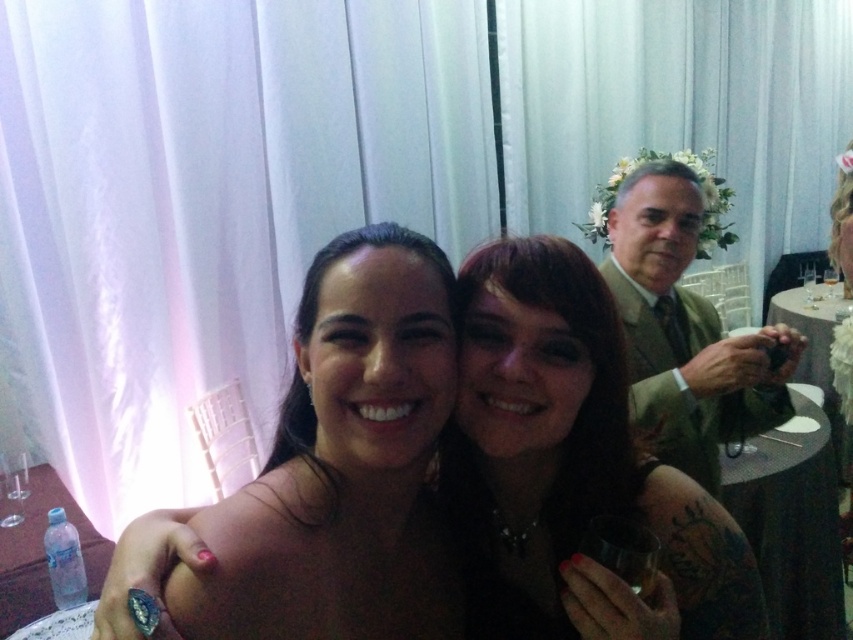
Does wooden table at lower right have a greater height compared to clear glass wine glass at upper right?

Yes, wooden table at lower right is taller than clear glass wine glass at upper right.

What are the coordinates of `wooden table at lower right` in the screenshot? It's located at (791, 524).

Between point (798, 480) and point (833, 294), which one is positioned in front?

Point (798, 480) is more forward.

Locate an element on the screen. The height and width of the screenshot is (640, 853). wooden table at lower right is located at coordinates click(791, 524).

Which is in front, point (840, 436) or point (813, 282)?

Point (840, 436) is in front.

You are a GUI agent. You are given a task and a screenshot of the screen. Output one action in this format:
    pyautogui.click(x=<x>, y=<y>)
    Task: Click on the white glossy table at right
    
    Given the screenshot: What is the action you would take?
    pyautogui.click(x=817, y=356)

Where is `white glossy table at right`? white glossy table at right is located at coordinates (817, 356).

Is matte black hair at center closer to the viewer compared to white glossy table at right?

Yes.

Between point (556, 426) and point (822, 388), which one is positioned in front?

Point (556, 426) is in front.

Where is `matte black hair at center`? matte black hair at center is located at coordinates (572, 467).